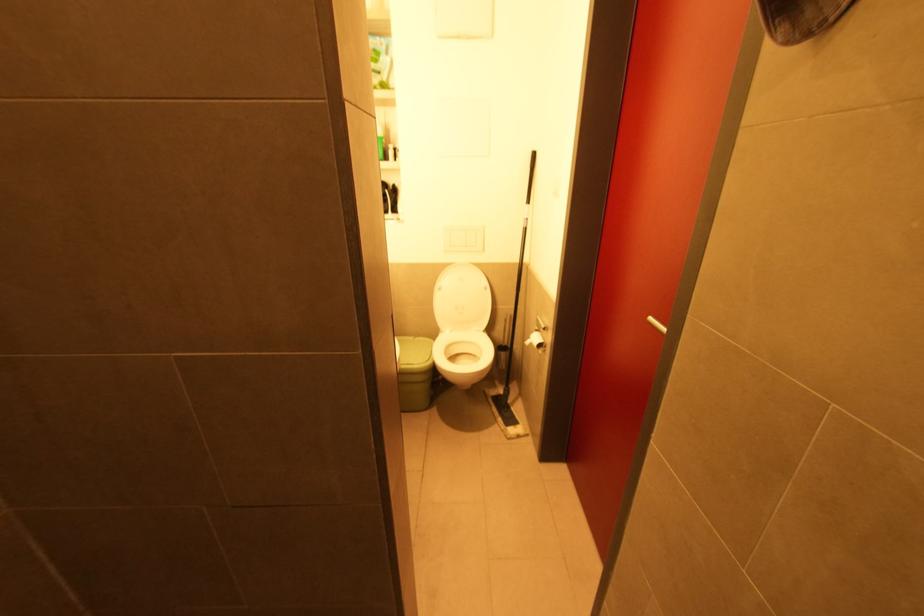
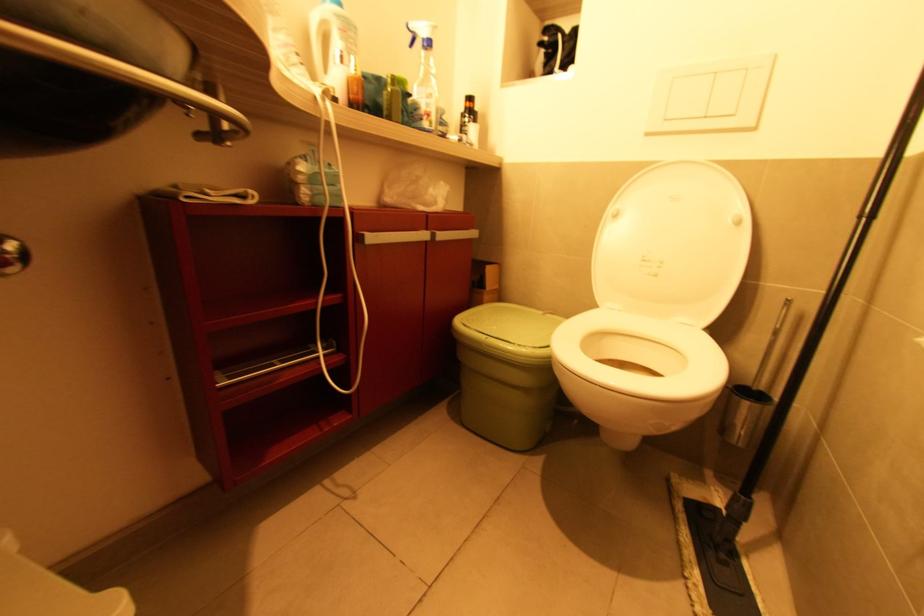
Find the pixel in the second image that matches [441,290] in the first image.

(617, 217)